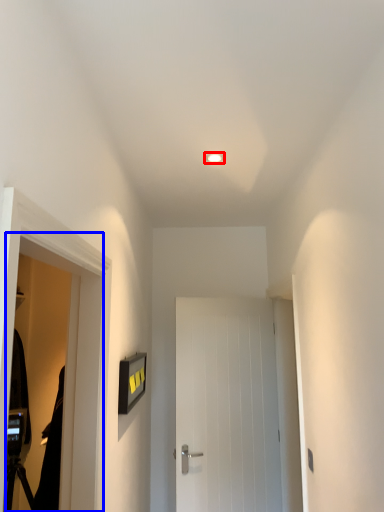
Question: Among these objects, which one is farthest to the camera, lighting (highlighted by a red box) or screen door (highlighted by a blue box)?

Choices:
 (A) lighting
 (B) screen door

Answer: (A)